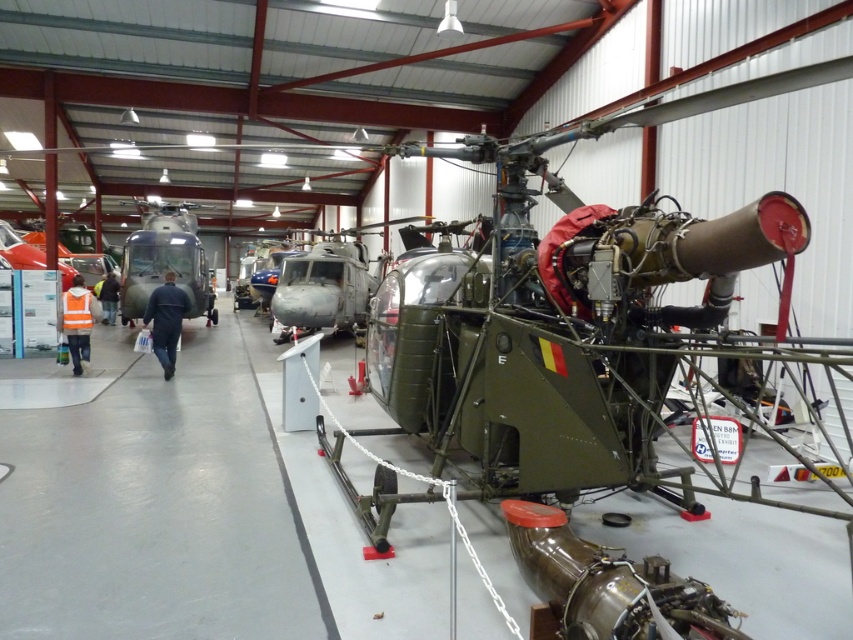
Between point (339, 273) and point (212, 289), which one is positioned in front?

Point (339, 273) is more forward.

Between point (369, 285) and point (175, 241), which one is positioned in front?

Point (175, 241)

In order to click on metallic gray helicopter at center in this screenshot , I will do `click(322, 291)`.